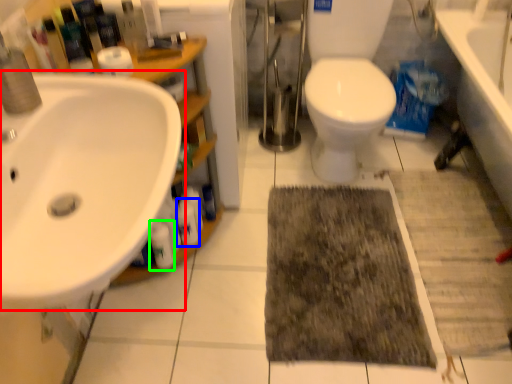
Question: Estimate the real-world distances between objects in this image. Which object is farther from sink (highlighted by a red box), cleaning product (highlighted by a blue box) or cleaning product (highlighted by a green box)?

Choices:
 (A) cleaning product
 (B) cleaning product

Answer: (A)